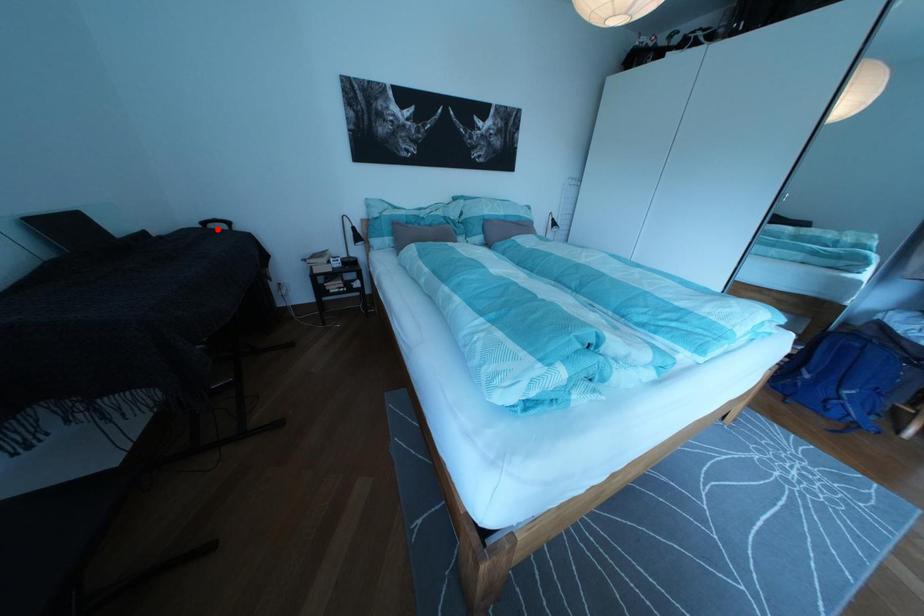
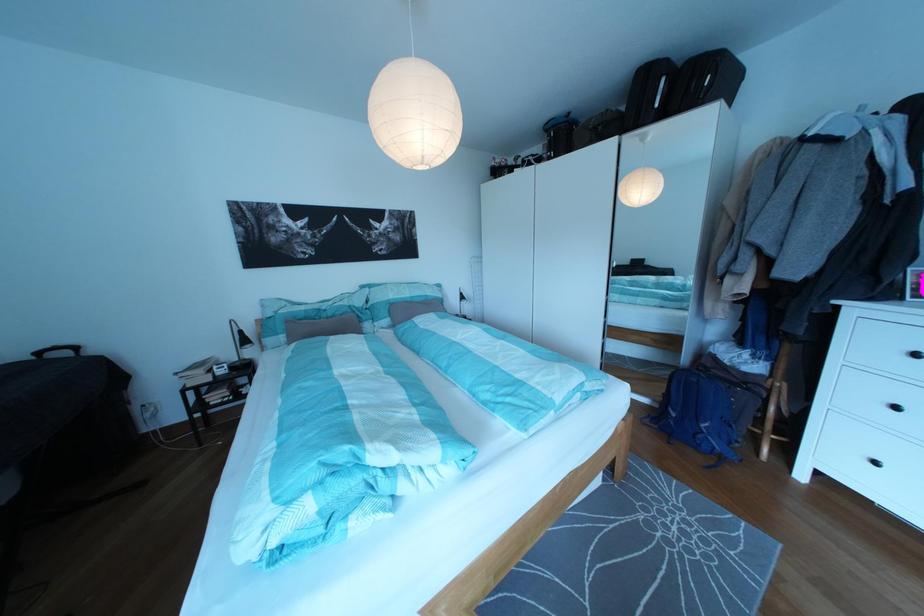
Question: I am providing you with two images of the same scene from different viewpoints. In image1, a red point is highlighted. Considering the same 3D point in image2, which of the following is correct?

Choices:
 (A) It is closer
 (B) It is farther

Answer: (B)